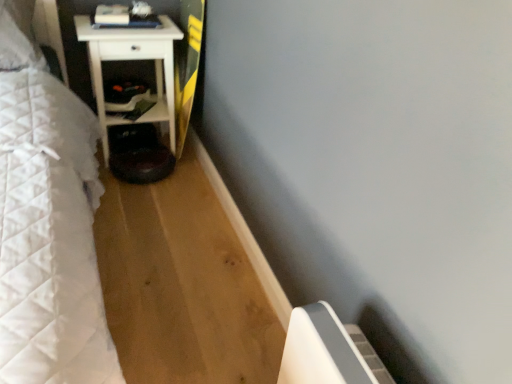
The image size is (512, 384). What are the coordinates of `free location in front of shiny black step stool at lower center` in the screenshot? It's located at (143, 202).